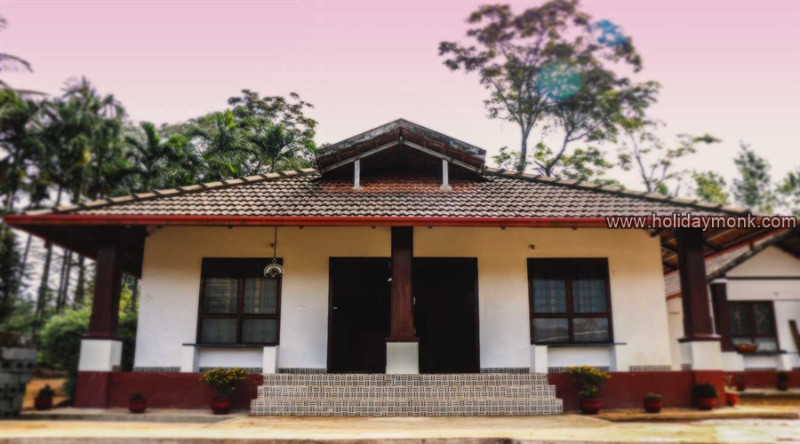
Identify the location of stairs. This screenshot has height=444, width=800. point(365,385), point(368,396), point(366,408).